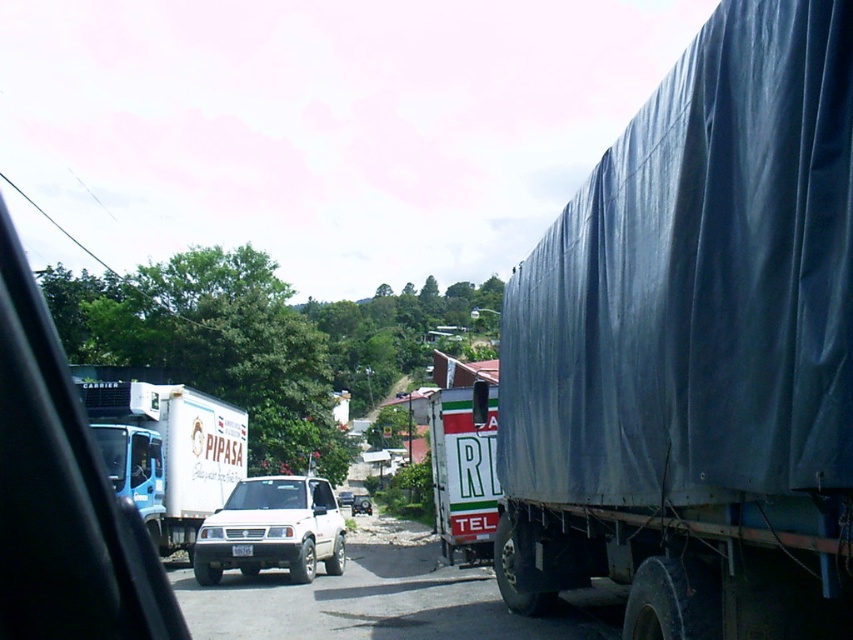
Question: Which is farther from the dark gray tarpaulin trailer truck at right?

Choices:
 (A) white matte suv at center
 (B) white matte truck at left

Answer: (B)

Question: Does dark gray tarpaulin trailer truck at right appear on the left side of white matte truck at center?

Choices:
 (A) yes
 (B) no

Answer: (B)

Question: Can you confirm if white matte truck at left is positioned to the right of white matte truck at center?

Choices:
 (A) no
 (B) yes

Answer: (A)

Question: Does white matte truck at left appear on the left side of white matte truck at center?

Choices:
 (A) no
 (B) yes

Answer: (B)

Question: Estimate the real-world distances between objects in this image. Which object is closer to the dark gray tarpaulin trailer truck at right?

Choices:
 (A) white matte truck at left
 (B) white matte suv at center

Answer: (B)

Question: Which is nearer to the dark gray tarpaulin trailer truck at right?

Choices:
 (A) white matte truck at left
 (B) white matte suv at center
 (C) white matte truck at center

Answer: (C)